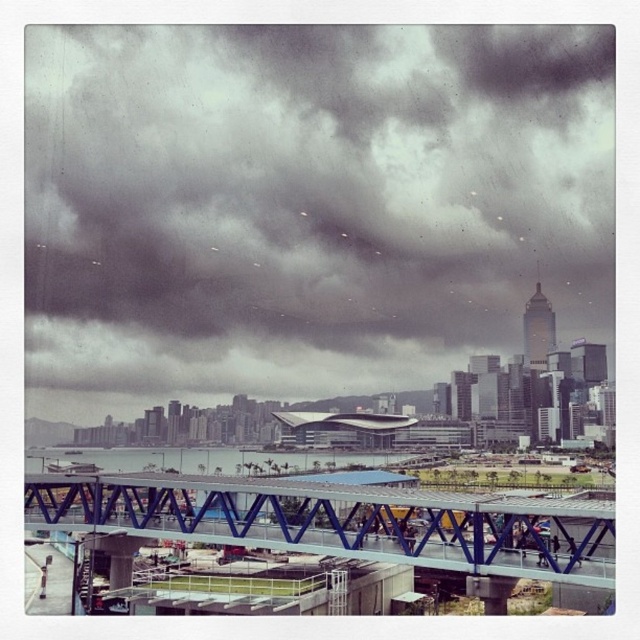
Is dark gray cloud at upper center shorter than blue metallic bridge at center?

No.

Can you confirm if dark gray cloud at upper center is bigger than blue metallic bridge at center?

Yes.

Is point (128, 93) positioned after point (132, 515)?

Yes.

Where is `dark gray cloud at upper center`? dark gray cloud at upper center is located at coordinates (308, 200).

Can you confirm if blue metallic bridge at center is bigger than transparent glass water at center?

No.

Between blue metallic bridge at center and transparent glass water at center, which one appears on the left side from the viewer's perspective?

transparent glass water at center

Between point (532, 524) and point (364, 481), which one is positioned in front?

Point (532, 524)

The image size is (640, 640). Find the location of `blue metallic bridge at center`. blue metallic bridge at center is located at coordinates (340, 522).

The height and width of the screenshot is (640, 640). Find the location of `dark gray cloud at upper center`. dark gray cloud at upper center is located at coordinates (308, 200).

Between dark gray cloud at upper center and transparent glass water at center, which one has less height?

transparent glass water at center is shorter.

The width and height of the screenshot is (640, 640). Describe the element at coordinates (308, 200) in the screenshot. I see `dark gray cloud at upper center` at that location.

This screenshot has width=640, height=640. I want to click on dark gray cloud at upper center, so click(308, 200).